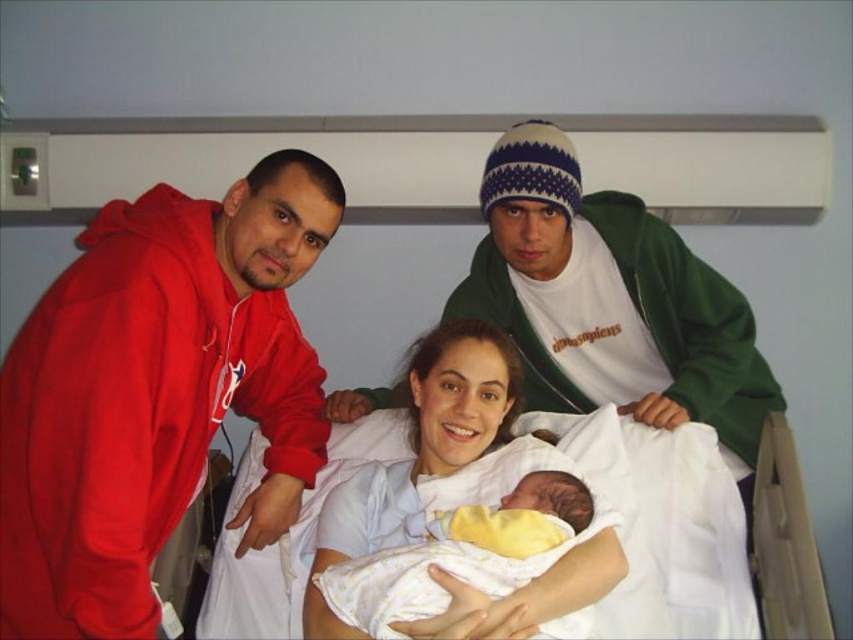
You are a nurse in the hospital room. You need to place a medical chart on the white fabric at center. What are the coordinates where you should place it?

The white fabric at center is located at coordinates point (448, 500), so place the medical chart there.

You are a hospital staff member who needs to determine which item is bigger between the matte red hoodie at left and the white fabric at center. Based on the scene, which one should you report as larger?

The matte red hoodie at left is larger in size than the white fabric at center, so you should report the matte red hoodie at left as the larger item.

You are a nurse in a hospital room and need to place a new medical chart on the counter. The counter has limited space. You have the matte red hoodie at left and the yellow soft fabric newborn at center. Which item takes up more horizontal space?

The matte red hoodie at left is wider than the yellow soft fabric newborn at center, so the matte red hoodie at left takes up more horizontal space.